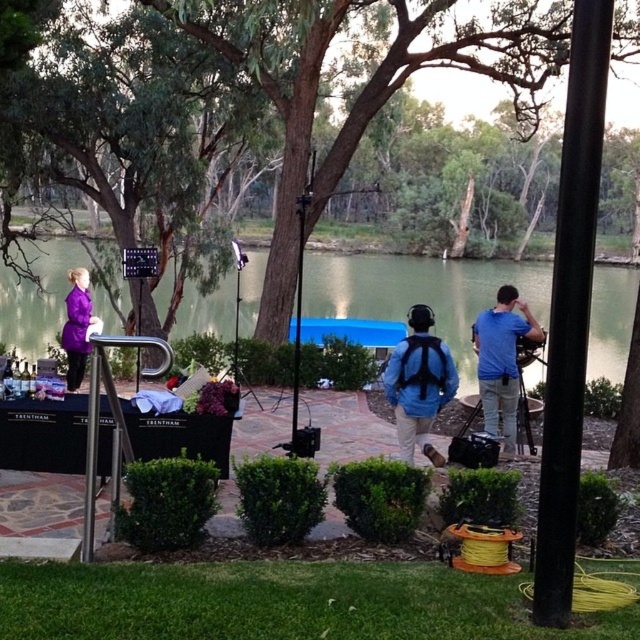
Question: Which of the following is the farthest from the observer?

Choices:
 (A) blue fabric shirt at center
 (B) matte purple coat at left
 (C) green water at center
 (D) green leafy tree at upper center

Answer: (B)

Question: Is green leafy tree at upper center positioned behind blue matte backpack at center?

Choices:
 (A) no
 (B) yes

Answer: (B)

Question: Which point appears farthest from the camera in this image?

Choices:
 (A) (394, 305)
 (B) (76, 330)
 (C) (419, 390)
 (D) (509, 392)

Answer: (A)

Question: Is the position of green water at center more distant than that of matte purple coat at left?

Choices:
 (A) no
 (B) yes

Answer: (A)

Question: Is green water at center smaller than matte purple coat at left?

Choices:
 (A) yes
 (B) no

Answer: (B)

Question: Among these objects, which one is farthest from the camera?

Choices:
 (A) blue matte backpack at center
 (B) blue fabric shirt at center
 (C) green leafy tree at upper center

Answer: (C)